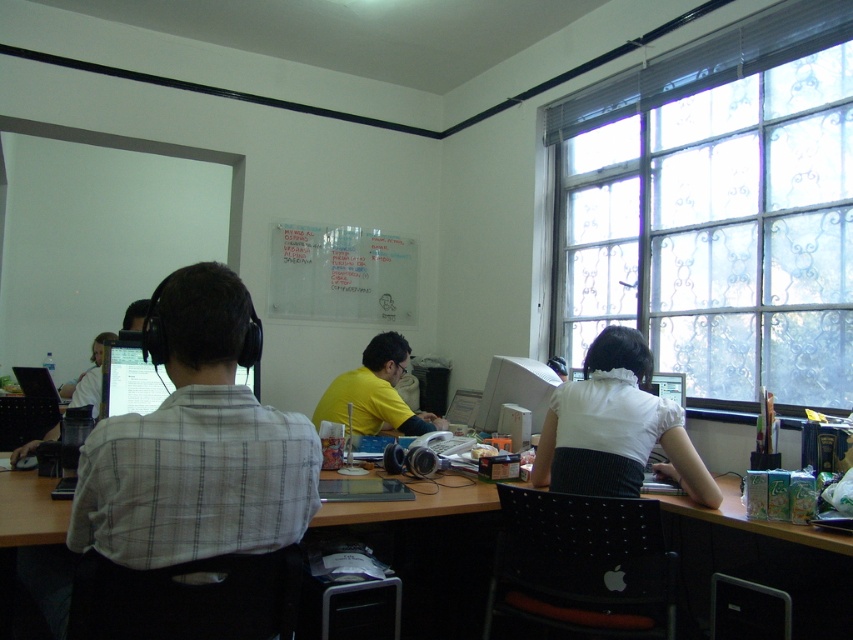
Question: Does transparent glass window at right appear on the left side of yellow matte shirt at center?

Choices:
 (A) no
 (B) yes

Answer: (A)

Question: Does white fabric shirt at center appear under yellow matte shirt at center?

Choices:
 (A) yes
 (B) no

Answer: (B)

Question: Does wooden desk at center have a smaller size compared to white fabric shirt at center?

Choices:
 (A) no
 (B) yes

Answer: (A)

Question: Which point is farther to the camera?

Choices:
 (A) matte black monitor at left
 (B) transparent glass window at right
 (C) white checkered shirt at left

Answer: (B)

Question: Which point is closer to the camera taking this photo?

Choices:
 (A) (741, 529)
 (B) (730, 292)

Answer: (A)

Question: Which object is farther from the camera taking this photo?

Choices:
 (A) wooden desk at center
 (B) white fabric shirt at center
 (C) white checkered shirt at left
 (D) matte black monitor at left

Answer: (B)